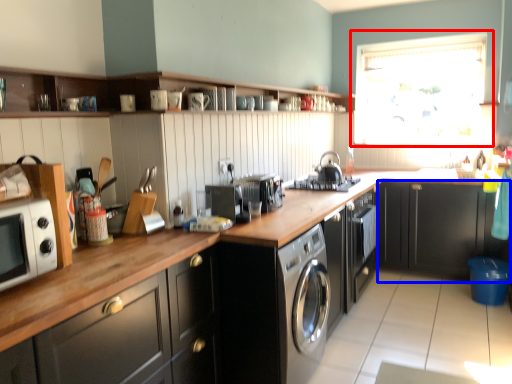
Question: Among these objects, which one is farthest to the camera, window (highlighted by a red box) or cabinetry (highlighted by a blue box)?

Choices:
 (A) window
 (B) cabinetry

Answer: (A)